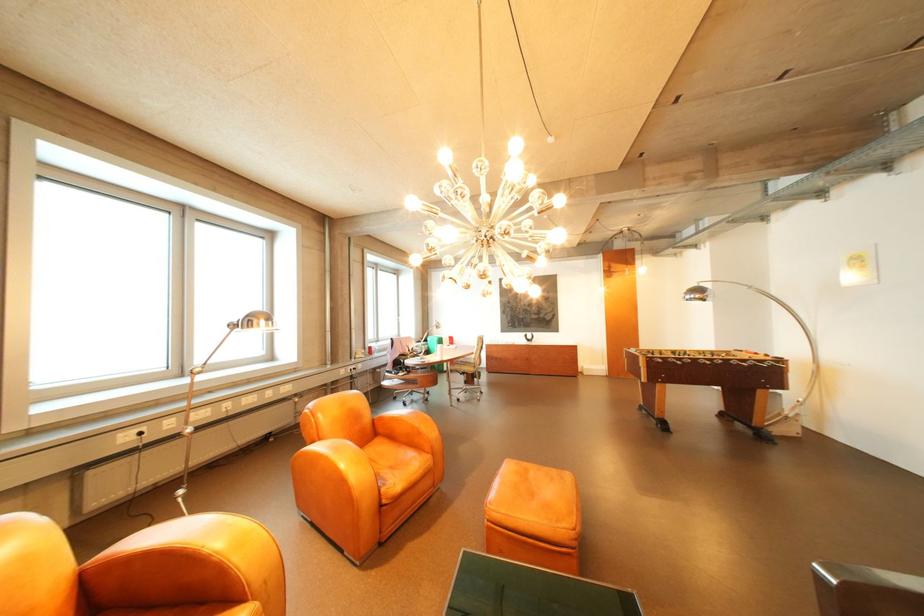
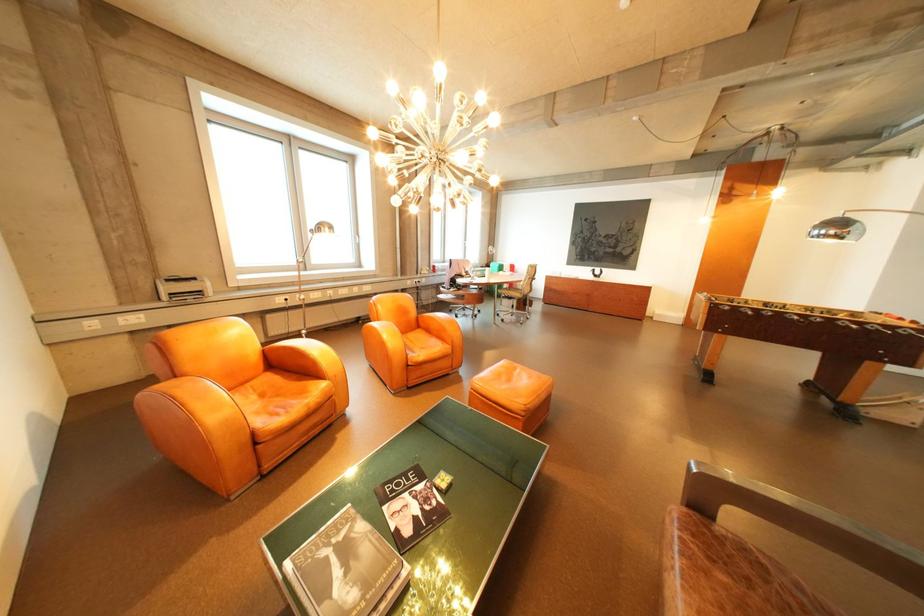
Locate, in the second image, the point that corresponds to point 408,484 in the first image.

(432, 355)